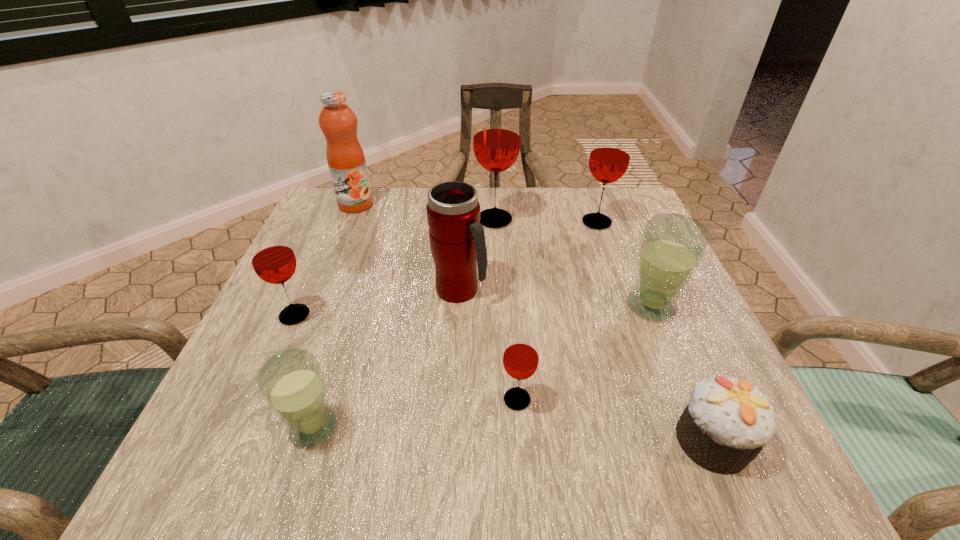
What are the coordinates of `free space located 0.050m on the left of the nearer blue glass` in the screenshot? It's located at (252, 428).

Where is `vacant area located 0.390m on the back of the cupcake`? The image size is (960, 540). vacant area located 0.390m on the back of the cupcake is located at coordinates (633, 253).

Identify the location of fruit juice that is at the far edge. This screenshot has height=540, width=960. (346, 161).

I want to click on glass situated at the near edge, so click(291, 382).

Image resolution: width=960 pixels, height=540 pixels. In order to click on cupcake positioned at the near edge in this screenshot , I will do `click(727, 422)`.

Find the location of `fruit juice that is positioned at the left edge`. fruit juice that is positioned at the left edge is located at coordinates (346, 161).

The image size is (960, 540). Find the location of `cupcake at the right edge`. cupcake at the right edge is located at coordinates (727, 422).

This screenshot has height=540, width=960. I want to click on object that is at the far left corner, so click(x=346, y=161).

Image resolution: width=960 pixels, height=540 pixels. Find the location of `object that is positioned at the near left corner`. object that is positioned at the near left corner is located at coordinates (291, 382).

The height and width of the screenshot is (540, 960). Find the location of `object that is at the far right corner`. object that is at the far right corner is located at coordinates (610, 154).